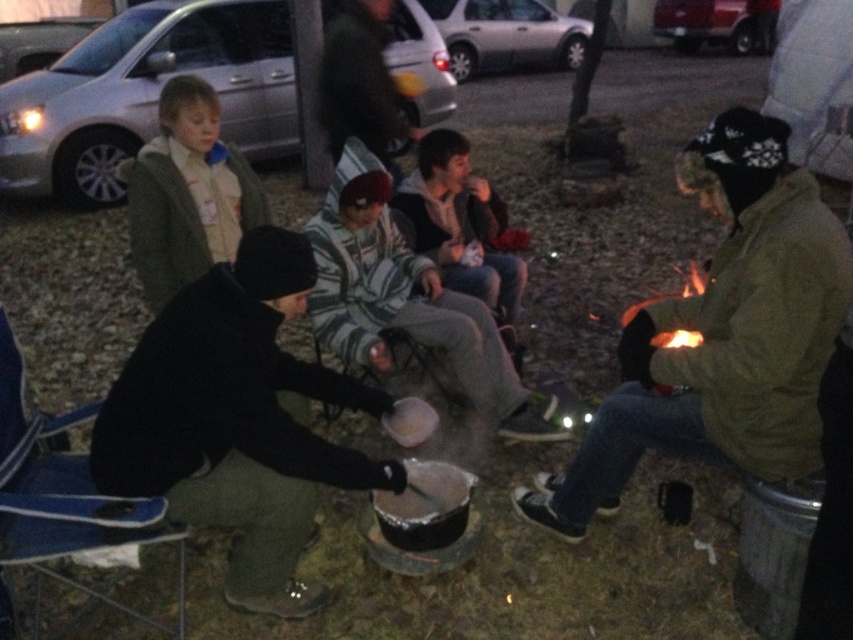
Question: Can you confirm if camouflage-patterned jacket at right is wider than black matte pot at center?

Choices:
 (A) yes
 (B) no

Answer: (B)

Question: Which object is closer to the camera taking this photo?

Choices:
 (A) camouflage-patterned jacket at right
 (B) striped fabric jacket at center
 (C) black matte pot at center

Answer: (A)

Question: Where is camouflage-patterned jacket at right located in relation to black matte pot at center in the image?

Choices:
 (A) above
 (B) below

Answer: (A)

Question: Based on their relative distances, which object is nearer to the black matte pot at center?

Choices:
 (A) camouflage-patterned jacket at right
 (B) striped fabric jacket at center

Answer: (B)

Question: Where is camouflage-patterned jacket at right located in relation to striped fabric jacket at center in the image?

Choices:
 (A) below
 (B) above

Answer: (A)

Question: Which point is closer to the camera taking this photo?

Choices:
 (A) (300, 588)
 (B) (717, 147)

Answer: (B)